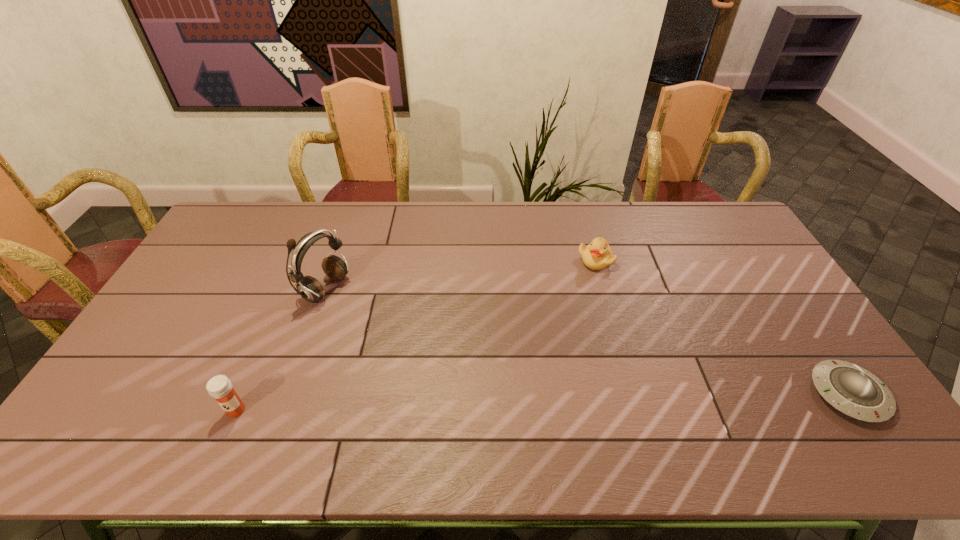
Find the location of a particular element. vacant space that's between the shortest object and the leftmost object is located at coordinates (542, 402).

Where is `unoccupied area between the third shortest object and the shortest object`? The width and height of the screenshot is (960, 540). unoccupied area between the third shortest object and the shortest object is located at coordinates (542, 402).

At what (x,y) coordinates should I click in order to perform the action: click on free space between the third object from right to left and the medicine. Please return your answer as a coordinate pair (x, y). This screenshot has width=960, height=540. Looking at the image, I should click on (281, 349).

Select which object appears as the closest to the second shortest object. Please provide its 2D coordinates. Your answer should be formatted as a tuple, i.e. [(x, y)], where the tuple contains the x and y coordinates of a point satisfying the conditions above.

[(856, 392)]

Where is `object that is the second closest to the tallest object`? object that is the second closest to the tallest object is located at coordinates (598, 255).